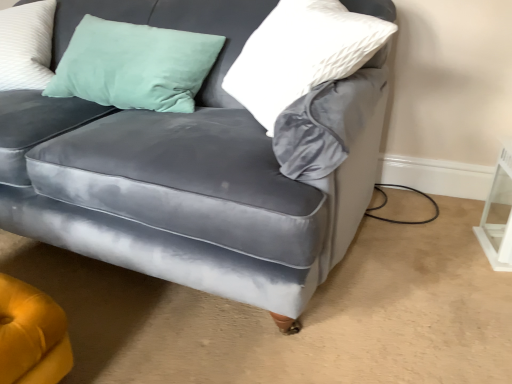
Identify the location of velvet gray couch at center. (180, 175).

What is the approximate width of white textured pillow at upper right?

The width of white textured pillow at upper right is 10.74 inches.

At what (x,y) coordinates should I click in order to perform the action: click on velvet gray couch at center. Please return your answer as a coordinate pair (x, y). The image size is (512, 384). Looking at the image, I should click on (180, 175).

Is velvet gray couch at center bigger than white textured pillow at upper right?

Correct, velvet gray couch at center is larger in size than white textured pillow at upper right.

Which object is thinner, velvet gray couch at center or white textured pillow at upper right?

Thinner between the two is white textured pillow at upper right.

From a real-world perspective, is velvet gray couch at center physically located above or below white textured pillow at upper right?

In terms of real-world spatial position, velvet gray couch at center is below white textured pillow at upper right.

Who is taller, velvet gray couch at center or white textured pillow at upper right?

Standing taller between the two is velvet gray couch at center.

Which point is more forward, (x=284, y=81) or (x=145, y=180)?

The point (x=145, y=180) is closer.

From the image's perspective, is white textured pillow at upper right under velvet gray couch at center?

Actually, white textured pillow at upper right appears above velvet gray couch at center in the image.

Between white textured pillow at upper right and velvet gray couch at center, which one is positioned in front?

velvet gray couch at center is closer to the camera.

Is velvet gray couch at center outside of white glossy table at lower right?

Yes, velvet gray couch at center is located beyond the bounds of white glossy table at lower right.

From the image's perspective, which is above, velvet gray couch at center or white glossy table at lower right?

velvet gray couch at center is shown above in the image.

Does velvet gray couch at center have a larger size compared to white glossy table at lower right?

Yes, velvet gray couch at center is bigger than white glossy table at lower right.

Is velvet gray couch at center oriented away from white glossy table at lower right?

That's not correct — velvet gray couch at center is not looking away from white glossy table at lower right.

Find the location of a particular element. studio couch above the white glossy table at lower right (from a real-world perspective) is located at coordinates (180, 175).

Between white glossy table at lower right and velvet gray couch at center, which one is positioned behind?

white glossy table at lower right is behind.

Between white glossy table at lower right and velvet gray couch at center, which one has smaller size?

With smaller size is white glossy table at lower right.

Can you confirm if white glossy table at lower right is shorter than velvet gray couch at center?

Correct, white glossy table at lower right is not as tall as velvet gray couch at center.

From a real-world perspective, is white glossy table at lower right positioned above or below white textured pillow at upper right?

In terms of real-world spatial position, white glossy table at lower right is below white textured pillow at upper right.

From the image's perspective, is white glossy table at lower right on top of white textured pillow at upper right?

No.

In the scene shown: What's the angular difference between white glossy table at lower right and white textured pillow at upper right's facing directions?

The angle between the facing direction of white glossy table at lower right and the facing direction of white textured pillow at upper right is 60.7 degrees.

Can you confirm if white glossy table at lower right is bigger than white textured pillow at upper right?

Actually, white glossy table at lower right might be smaller than white textured pillow at upper right.

Between white textured pillow at upper right and white glossy table at lower right, which one has larger width?

white glossy table at lower right.

Is point (365, 33) less distant than point (492, 224)?

Yes, it is.

Is white textured pillow at upper right placed right next to white glossy table at lower right?

No.

Locate an element on the screen. The height and width of the screenshot is (384, 512). pillow on the right of velvet gray couch at center is located at coordinates (301, 54).

This screenshot has width=512, height=384. Find the location of `studio couch that is on the left side of white textured pillow at upper right`. studio couch that is on the left side of white textured pillow at upper right is located at coordinates (180, 175).

Estimate the real-world distances between objects in this image. Which object is closer to velvet gray couch at center, white textured pillow at upper right or white glossy table at lower right?

white textured pillow at upper right is positioned closer to the anchor velvet gray couch at center.

Based on the photo, which object lies further to the anchor point velvet gray couch at center, white glossy table at lower right or white textured pillow at upper right?

white glossy table at lower right lies further to velvet gray couch at center than the other object.

Based on their spatial positions, is white textured pillow at upper right or velvet gray couch at center further from white glossy table at lower right?

Among the two, velvet gray couch at center is located further to white glossy table at lower right.

Considering their positions, is white glossy table at lower right positioned further to white textured pillow at upper right than velvet gray couch at center?

The object further to white textured pillow at upper right is white glossy table at lower right.

Based on their spatial positions, is velvet gray couch at center or white glossy table at lower right further from white textured pillow at upper right?

white glossy table at lower right is positioned further to the anchor white textured pillow at upper right.

Looking at the image, which one is located further to white glossy table at lower right, velvet gray couch at center or white textured pillow at upper right?

velvet gray couch at center lies further to white glossy table at lower right than the other object.

This screenshot has height=384, width=512. I want to click on pillow between velvet gray couch at center and white glossy table at lower right from left to right, so click(x=301, y=54).